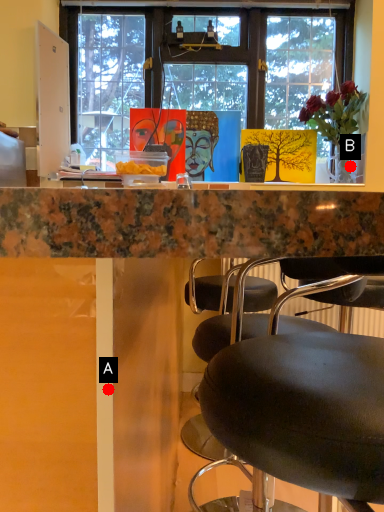
Question: Two points are circled on the image, labeled by A and B beside each circle. Which point is closer to the camera?

Choices:
 (A) A is closer
 (B) B is closer

Answer: (A)